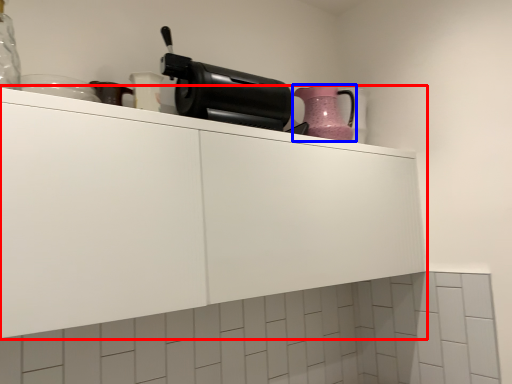
Question: Which object appears closest to the camera in this image, cabinetry (highlighted by a red box) or kitchen appliance (highlighted by a blue box)?

Choices:
 (A) cabinetry
 (B) kitchen appliance

Answer: (A)